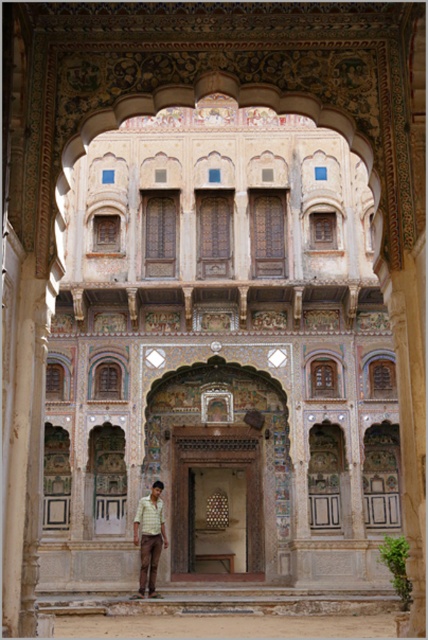
Does checkered shirt at center have a lesser height compared to yellow checkered shirt at lower center?

Yes.

Who is taller, checkered shirt at center or yellow checkered shirt at lower center?

yellow checkered shirt at lower center

Does point (139, 582) come behind point (149, 515)?

No.

Identify the location of checkered shirt at center. (149, 538).